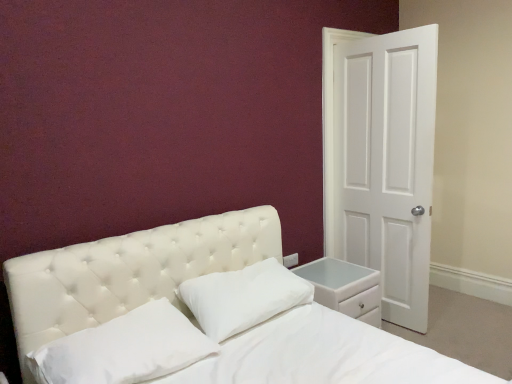
Question: From the image's perspective, is white matte door at right located above white soft pillow at center, which appears as the first pillow when viewed from the left?

Choices:
 (A) yes
 (B) no

Answer: (A)

Question: Does white matte door at right appear on the left side of white soft pillow at center, the second pillow in the right-to-left sequence?

Choices:
 (A) yes
 (B) no

Answer: (B)

Question: Is white matte door at right beside white soft pillow at center, which appears as the first pillow when viewed from the left?

Choices:
 (A) no
 (B) yes

Answer: (A)

Question: From a real-world perspective, is white matte door at right on top of white soft pillow at center, the second pillow in the right-to-left sequence?

Choices:
 (A) no
 (B) yes

Answer: (B)

Question: Is white matte door at right shorter than white soft pillow at center, the second pillow in the right-to-left sequence?

Choices:
 (A) yes
 (B) no

Answer: (B)

Question: From a real-world perspective, is white matte door at right under white soft pillow at center, which appears as the first pillow when viewed from the left?

Choices:
 (A) no
 (B) yes

Answer: (A)

Question: Is white matte door at right positioned far away from white soft pillow at center, the 1th pillow positioned from the right?

Choices:
 (A) yes
 (B) no

Answer: (A)

Question: Is white matte door at right at the right side of white soft pillow at center, which is the 2th pillow from left to right?

Choices:
 (A) yes
 (B) no

Answer: (A)

Question: Could you tell me if white matte door at right is facing white soft pillow at center, the 1th pillow positioned from the right?

Choices:
 (A) no
 (B) yes

Answer: (A)

Question: Is white soft pillow at center, the 1th pillow positioned from the right, located within white matte door at right?

Choices:
 (A) yes
 (B) no

Answer: (B)

Question: Are white matte door at right and white soft pillow at center, the 1th pillow positioned from the right, making contact?

Choices:
 (A) no
 (B) yes

Answer: (A)

Question: Can you confirm if white matte door at right is bigger than white soft pillow at center, which is the 2th pillow from left to right?

Choices:
 (A) no
 (B) yes

Answer: (B)

Question: Considering the relative sizes of white leather nightstand at lower right and white soft pillow at center, the second pillow in the right-to-left sequence, in the image provided, is white leather nightstand at lower right thinner than white soft pillow at center, the second pillow in the right-to-left sequence,?

Choices:
 (A) yes
 (B) no

Answer: (B)